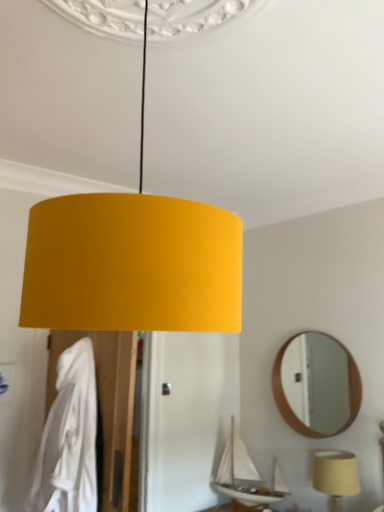
Question: In the image, is white fabric robe at left positioned in front of or behind wooden round mirror at upper right?

Choices:
 (A) front
 (B) behind

Answer: (A)

Question: Would you say white fabric robe at left is to the left or to the right of wooden round mirror at upper right in the picture?

Choices:
 (A) left
 (B) right

Answer: (A)

Question: Which of these objects is positioned farthest from the white fabric robe at left?

Choices:
 (A) matte beige lampshade at lower right
 (B) white matte sailboat at lower center
 (C) wooden round mirror at upper right

Answer: (C)

Question: Which is farther from the matte beige lampshade at lower right?

Choices:
 (A) white matte sailboat at lower center
 (B) wooden round mirror at upper right
 (C) white fabric robe at left

Answer: (C)